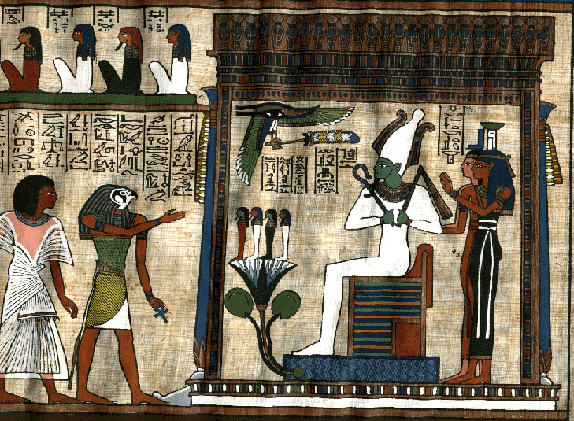
This screenshot has width=574, height=421. What are the coordinates of `painting` in the screenshot? It's located at (312, 190).